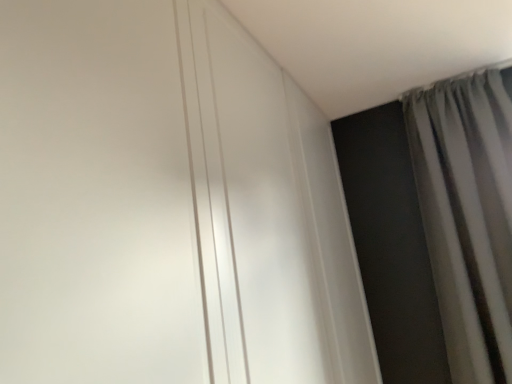
Question: From the image's perspective, is white glossy door at upper center on gray fabric curtain at upper right?

Choices:
 (A) no
 (B) yes

Answer: (B)

Question: Can you confirm if white glossy door at upper center is wider than gray fabric curtain at upper right?

Choices:
 (A) no
 (B) yes

Answer: (A)

Question: Is white glossy door at upper center taller than gray fabric curtain at upper right?

Choices:
 (A) yes
 (B) no

Answer: (B)

Question: Is white glossy door at upper center thinner than gray fabric curtain at upper right?

Choices:
 (A) no
 (B) yes

Answer: (B)

Question: Is white glossy door at upper center not within gray fabric curtain at upper right?

Choices:
 (A) yes
 (B) no

Answer: (A)

Question: Does white glossy door at upper center have a larger size compared to gray fabric curtain at upper right?

Choices:
 (A) yes
 (B) no

Answer: (B)

Question: Is gray fabric curtain at upper right aimed at white glossy door at upper center?

Choices:
 (A) yes
 (B) no

Answer: (B)

Question: Considering the relative positions of gray fabric curtain at upper right and white glossy door at upper center in the image provided, is gray fabric curtain at upper right to the right of white glossy door at upper center from the viewer's perspective?

Choices:
 (A) yes
 (B) no

Answer: (A)

Question: Is gray fabric curtain at upper right taller than white glossy door at upper center?

Choices:
 (A) no
 (B) yes

Answer: (B)

Question: Is gray fabric curtain at upper right located outside white glossy door at upper center?

Choices:
 (A) no
 (B) yes

Answer: (B)

Question: Does gray fabric curtain at upper right have a lesser height compared to white glossy door at upper center?

Choices:
 (A) no
 (B) yes

Answer: (A)

Question: Considering the relative sizes of gray fabric curtain at upper right and white glossy door at upper center in the image provided, is gray fabric curtain at upper right wider than white glossy door at upper center?

Choices:
 (A) no
 (B) yes

Answer: (B)

Question: From the image's perspective, is gray fabric curtain at upper right located above or below white glossy door at upper center?

Choices:
 (A) above
 (B) below

Answer: (B)